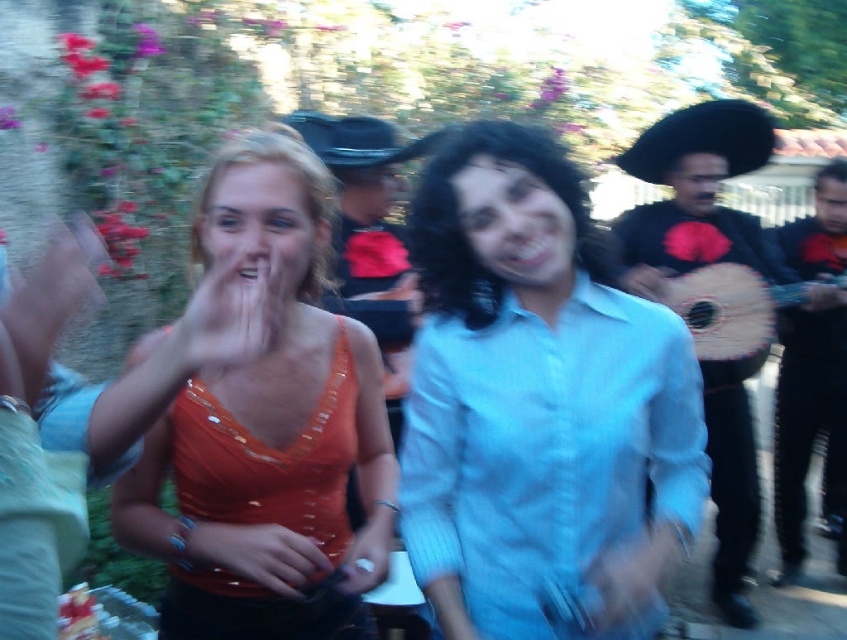
Question: Which point appears farthest from the camera in this image?

Choices:
 (A) (677, 131)
 (B) (615, 416)
 (C) (693, 337)

Answer: (A)

Question: Is light blue cotton shirt at center closer to camera compared to wooden acoustic guitar at center?

Choices:
 (A) no
 (B) yes

Answer: (B)

Question: Among these objects, which one is farthest from the camera?

Choices:
 (A) light blue cotton shirt at center
 (B) orange sequined top at left
 (C) pink glossy lips at center
 (D) wooden acoustic guitar at center

Answer: (D)

Question: Is orange sequined top at left further to the viewer compared to light blue cotton shirt at center?

Choices:
 (A) no
 (B) yes

Answer: (A)

Question: Among these points, which one is nearest to the camera?

Choices:
 (A) (257, 264)
 (B) (790, 541)
 (C) (451, 381)

Answer: (A)

Question: Is orange sequined top at left further to the viewer compared to black felt cowboy hat at upper right?

Choices:
 (A) yes
 (B) no

Answer: (B)